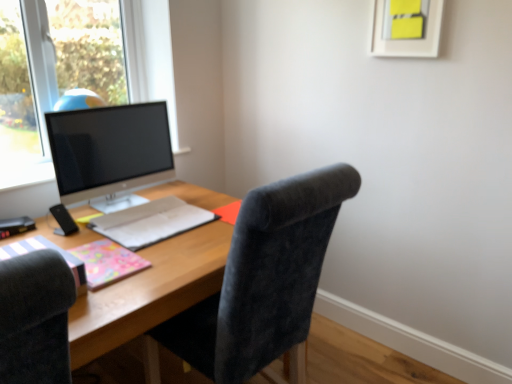
Question: Which direction should I rotate to look at matte gray notebook at center, which is the first notebook from back to front, — up or down?

Choices:
 (A) up
 (B) down

Answer: (B)

Question: Does satin black monitor at left lie in front of velvet dark gray chair at center?

Choices:
 (A) yes
 (B) no

Answer: (B)

Question: Considering the relative sizes of satin black monitor at left and velvet dark gray chair at center in the image provided, is satin black monitor at left wider than velvet dark gray chair at center?

Choices:
 (A) no
 (B) yes

Answer: (A)

Question: Does satin black monitor at left have a lesser height compared to velvet dark gray chair at center?

Choices:
 (A) yes
 (B) no

Answer: (A)

Question: Is satin black monitor at left not inside velvet dark gray chair at center?

Choices:
 (A) yes
 (B) no

Answer: (A)

Question: Considering the relative sizes of satin black monitor at left and velvet dark gray chair at center in the image provided, is satin black monitor at left thinner than velvet dark gray chair at center?

Choices:
 (A) yes
 (B) no

Answer: (A)

Question: Does satin black monitor at left appear on the left side of velvet dark gray chair at center?

Choices:
 (A) no
 (B) yes

Answer: (B)

Question: Considering the relative positions of pink glossy notebook at lower left, marked as the second notebook in a front-to-back arrangement, and matte pink notebook at left, the 1th notebook from the front, in the image provided, is pink glossy notebook at lower left, marked as the second notebook in a front-to-back arrangement, behind matte pink notebook at left, the 1th notebook from the front,?

Choices:
 (A) yes
 (B) no

Answer: (A)

Question: From a real-world perspective, is pink glossy notebook at lower left, marked as the second notebook in a front-to-back arrangement, over matte pink notebook at left, the 1th notebook from the front?

Choices:
 (A) yes
 (B) no

Answer: (B)

Question: Are pink glossy notebook at lower left, marked as the second notebook in a front-to-back arrangement, and matte pink notebook at left, which is the third notebook in back-to-front order, beside each other?

Choices:
 (A) yes
 (B) no

Answer: (B)

Question: Is matte pink notebook at left, the 1th notebook from the front, at the back of pink glossy notebook at lower left, marked as the second notebook in a front-to-back arrangement?

Choices:
 (A) yes
 (B) no

Answer: (B)

Question: Could you tell me if pink glossy notebook at lower left, positioned as the 2th notebook in back-to-front order, is facing matte pink notebook at left, which is the third notebook in back-to-front order?

Choices:
 (A) no
 (B) yes

Answer: (A)

Question: Is there a large distance between pink glossy notebook at lower left, positioned as the 2th notebook in back-to-front order, and matte pink notebook at left, the 1th notebook from the front?

Choices:
 (A) no
 (B) yes

Answer: (A)

Question: From a real-world perspective, is satin black monitor at left positioned under wooden desk at center based on gravity?

Choices:
 (A) no
 (B) yes

Answer: (A)